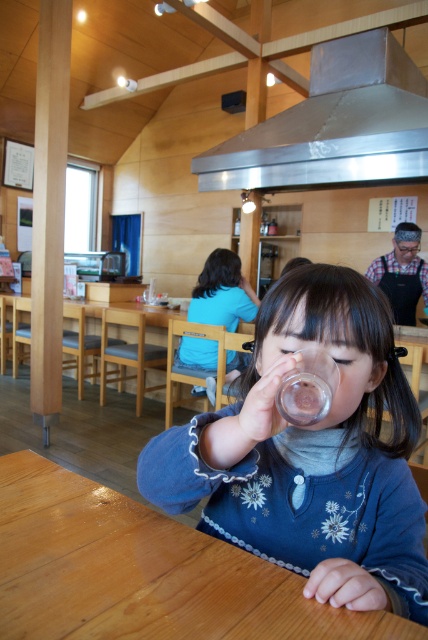
Can you confirm if stainless steel exhaust hood at upper center is wider than blue fabric shirt at center?

Yes.

Locate an element on the screen. The image size is (428, 640). stainless steel exhaust hood at upper center is located at coordinates (335, 124).

The image size is (428, 640). What do you see at coordinates (311, 452) in the screenshot? I see `blue fabric sweater at center` at bounding box center [311, 452].

Is blue fabric sweater at center smaller than wooden table at lower center?

No, blue fabric sweater at center is not smaller than wooden table at lower center.

Is point (401, 554) farther from viewer compared to point (252, 637)?

That is True.

Where is `blue fabric sweater at center`? Image resolution: width=428 pixels, height=640 pixels. blue fabric sweater at center is located at coordinates (311, 452).

Is wooden table at lower center closer to the viewer compared to stainless steel exhaust hood at upper center?

Yes, wooden table at lower center is closer to the viewer.

Is wooden table at lower center positioned at the back of stainless steel exhaust hood at upper center?

No, it is in front of stainless steel exhaust hood at upper center.

Identify the location of wooden table at lower center. This screenshot has width=428, height=640. (143, 572).